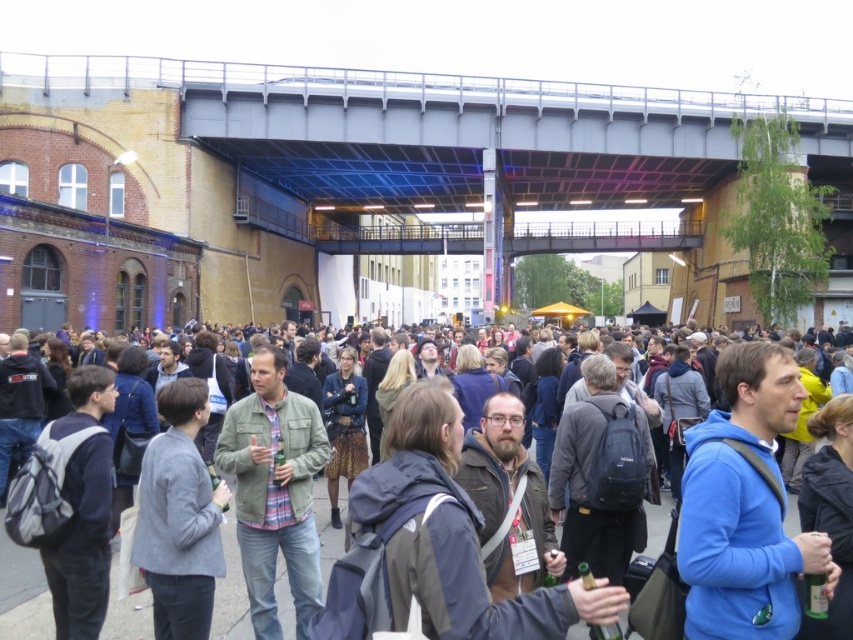
Is point (291, 522) behind point (48, 604)?

Yes.

Between green matte jacket at center and dark gray casual clothing at center, which one is positioned higher?

green matte jacket at center is above.

Between point (259, 572) and point (229, 598), which one is positioned in front?

Point (259, 572)

At what (x,y) coordinates should I click in order to perform the action: click on green matte jacket at center. Please return your answer as a coordinate pair (x, y). Looking at the image, I should click on (274, 490).

Which is more to the left, metallic gray bridge at center or green matte jacket at center?

green matte jacket at center is more to the left.

The height and width of the screenshot is (640, 853). What do you see at coordinates (442, 131) in the screenshot?
I see `metallic gray bridge at center` at bounding box center [442, 131].

At what (x,y) coordinates should I click in order to perform the action: click on metallic gray bridge at center. Please return your answer as a coordinate pair (x, y). This screenshot has height=640, width=853. Looking at the image, I should click on (442, 131).

Which is behind, point (198, 140) or point (4, 545)?

Point (198, 140)

At what (x,y) coordinates should I click in order to perform the action: click on metallic gray bridge at center. Please return your answer as a coordinate pair (x, y). The height and width of the screenshot is (640, 853). Looking at the image, I should click on (442, 131).

Based on the photo, who is more distant from viewer, (480,131) or (786,524)?

Point (480,131)

What are the coordinates of `metallic gray bridge at center` in the screenshot? It's located at (442, 131).